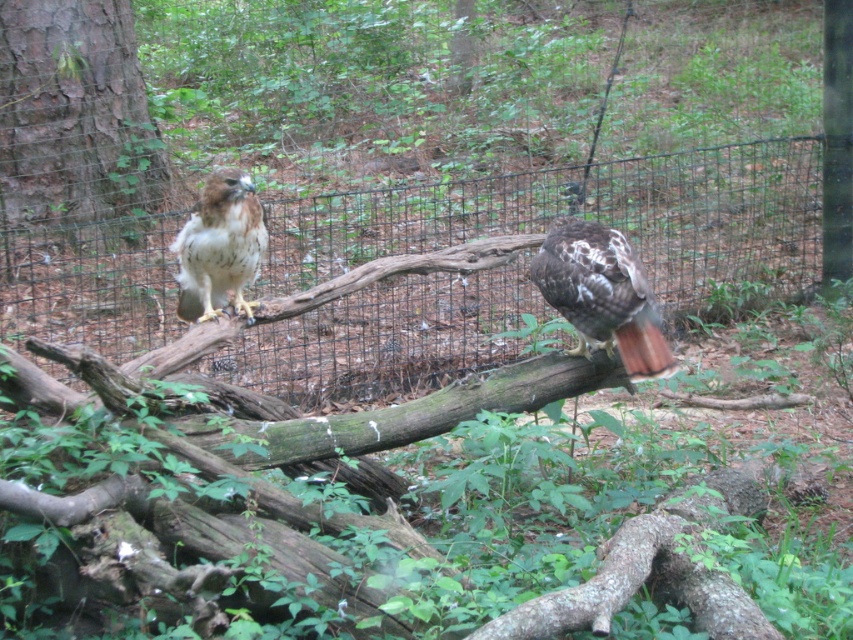
Question: Among these objects, which one is nearest to the camera?

Choices:
 (A) brown speckled feathers at left
 (B) brown rough bark tree at left
 (C) black wire mesh at center
 (D) brown speckled feathers at center

Answer: (D)

Question: Is brown rough bark tree at left wider than brown speckled feathers at left?

Choices:
 (A) no
 (B) yes

Answer: (B)

Question: Among these objects, which one is nearest to the camera?

Choices:
 (A) brown speckled feathers at left
 (B) brown rough bark tree at left
 (C) black wire mesh at center

Answer: (A)

Question: Is black wire mesh at center positioned before brown speckled feathers at left?

Choices:
 (A) no
 (B) yes

Answer: (A)

Question: Is black wire mesh at center further to the viewer compared to brown speckled feathers at left?

Choices:
 (A) yes
 (B) no

Answer: (A)

Question: Considering the real-world distances, which object is closest to the black wire mesh at center?

Choices:
 (A) brown speckled feathers at center
 (B) brown rough bark tree at left

Answer: (B)